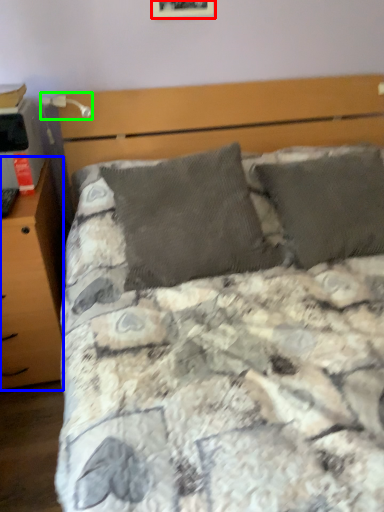
Question: Which object is the farthest from picture frame (highlighted by a red box)? Choose among these: nightstand (highlighted by a blue box) or table lamp (highlighted by a green box).

Choices:
 (A) nightstand
 (B) table lamp

Answer: (A)